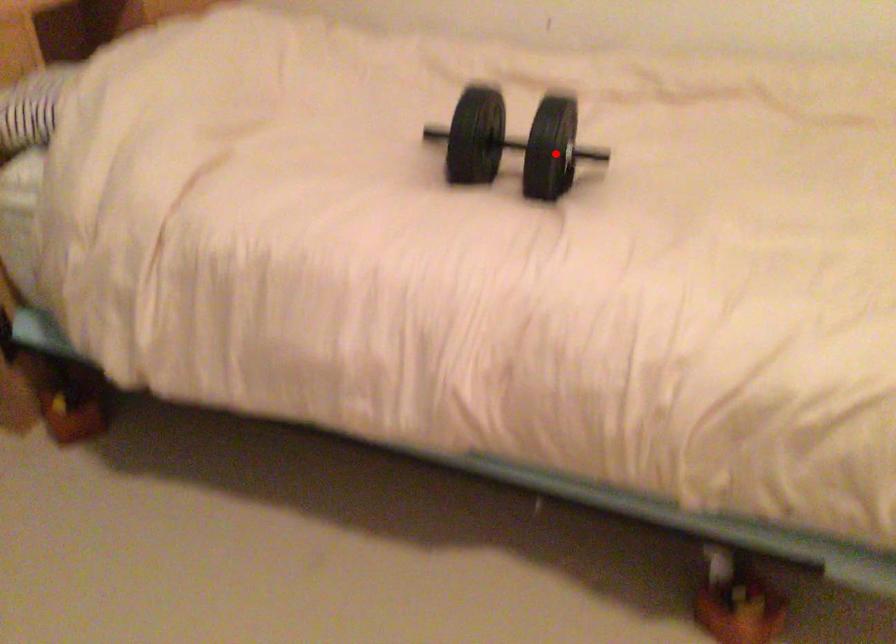
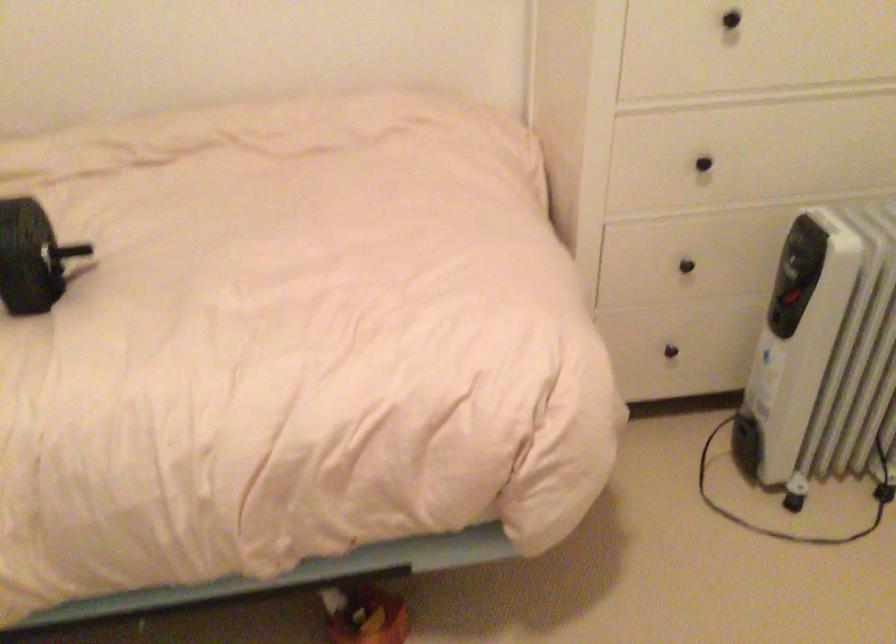
In the second image, find the point that corresponds to the highlighted location in the first image.

(30, 257)